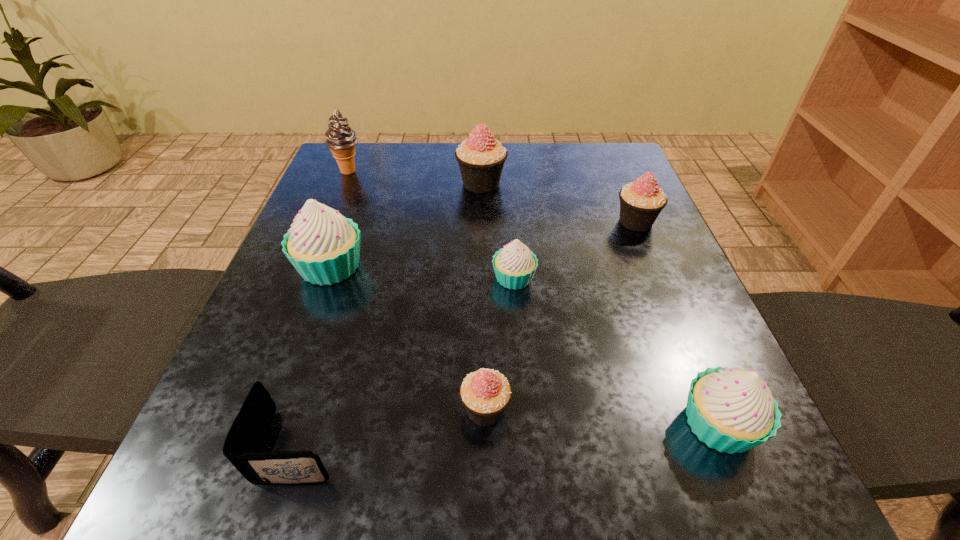
This screenshot has height=540, width=960. I want to click on free point between the rightmost white cupcake and the farthest pink cupcake, so click(x=600, y=303).

Identify the location of free spot between the third farthest object and the wallet. (468, 333).

You are a GUI agent. You are given a task and a screenshot of the screen. Output one action in this format:
    pyautogui.click(x=<x>, y=<y>)
    Task: Click on the vacant region between the farthest pink cupcake and the smallest pink cupcake
    This screenshot has height=540, width=960.
    Given the screenshot: What is the action you would take?
    pyautogui.click(x=483, y=296)

Where is `free space between the second biggest pink cupcake and the second smallest white cupcake`? The width and height of the screenshot is (960, 540). free space between the second biggest pink cupcake and the second smallest white cupcake is located at coordinates (677, 323).

Identify the location of free area in between the third farthest object and the farthest pink cupcake. This screenshot has height=540, width=960. (559, 202).

The height and width of the screenshot is (540, 960). Identify the location of object that is the fourth closest to the wallet. (732, 410).

Select which object appears as the fourth closest to the leftmost cupcake. Please provide its 2D coordinates. Your answer should be formatted as a tuple, i.e. [(x, y)], where the tuple contains the x and y coordinates of a point satisfying the conditions above.

[(341, 139)]

Choose which cupcake is the fifth nearest neighbor to the second white cupcake from left to right. Please provide its 2D coordinates. Your answer should be formatted as a tuple, i.e. [(x, y)], where the tuple contains the x and y coordinates of a point satisfying the conditions above.

[(732, 410)]

Choose which cupcake is the fourth nearest neighbor to the second white cupcake from right to left. Please provide its 2D coordinates. Your answer should be formatted as a tuple, i.e. [(x, y)], where the tuple contains the x and y coordinates of a point satisfying the conditions above.

[(323, 246)]

Choose which pink cupcake is the nearest neighbor to the smallest white cupcake. Please provide its 2D coordinates. Your answer should be formatted as a tuple, i.e. [(x, y)], where the tuple contains the x and y coordinates of a point satisfying the conditions above.

[(485, 393)]